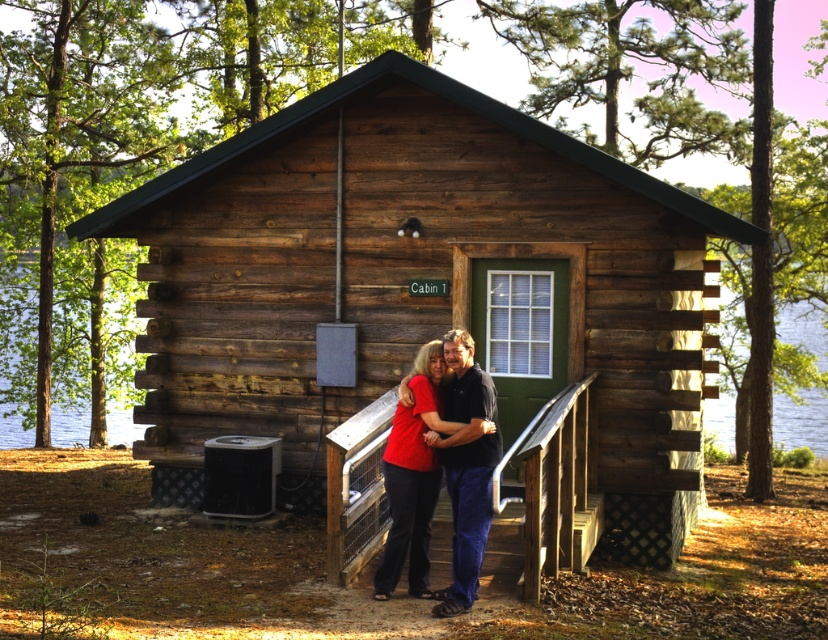
Is matte black couple at center shorter than transparent water at cabin right?

Correct, matte black couple at center is not as tall as transparent water at cabin right.

Is matte black couple at center wider than transparent water at cabin right?

In fact, matte black couple at center might be narrower than transparent water at cabin right.

Between point (475, 429) and point (788, 428), which one is positioned behind?

The point (788, 428) is behind.

Image resolution: width=828 pixels, height=640 pixels. I want to click on matte black couple at center, so click(x=465, y=460).

Between wooden cabin at center and transparent water at cabin right, which one is positioned lower?

wooden cabin at center

The height and width of the screenshot is (640, 828). I want to click on wooden cabin at center, so click(422, 282).

Is point (243, 177) positioned behind point (364, 419)?

Yes.

Is wooden cabin at center closer to camera compared to wooden stairs at center?

That is False.

Where is `wooden cabin at center`? This screenshot has width=828, height=640. wooden cabin at center is located at coordinates (422, 282).